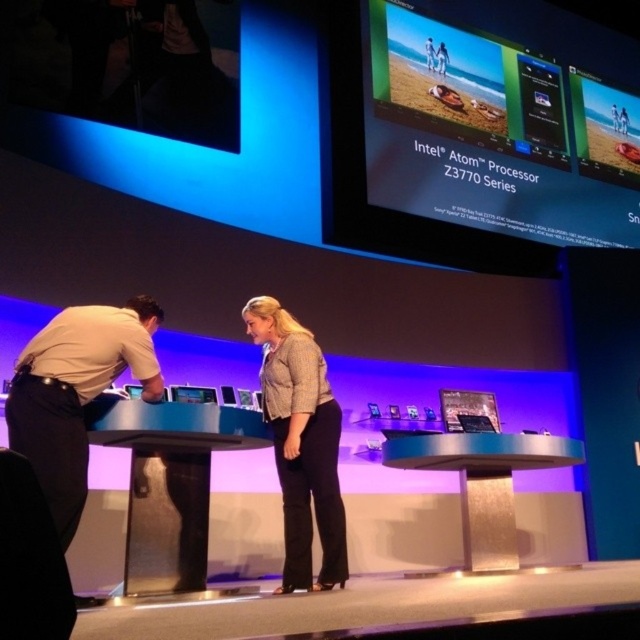
Question: Which object is positioned farthest from the light gray textured blazer at center?

Choices:
 (A) matte black laptop at center
 (B) matte black screen at upper center

Answer: (B)

Question: Which of the following is the farthest from the observer?

Choices:
 (A) light gray textured blazer at center
 (B) light beige shirt at left

Answer: (A)

Question: Can you confirm if matte black screen at upper center is positioned below light beige shirt at left?

Choices:
 (A) no
 (B) yes

Answer: (A)

Question: Which object is positioned farthest from the matte black laptop at center?

Choices:
 (A) matte black tablet at center
 (B) matte black screen at upper center
 (C) light beige shirt at left

Answer: (B)

Question: Can you confirm if matte black screen at upper center is smaller than light gray textured blazer at center?

Choices:
 (A) yes
 (B) no

Answer: (B)

Question: Can you confirm if matte black screen at upper center is thinner than light gray textured blazer at center?

Choices:
 (A) yes
 (B) no

Answer: (B)